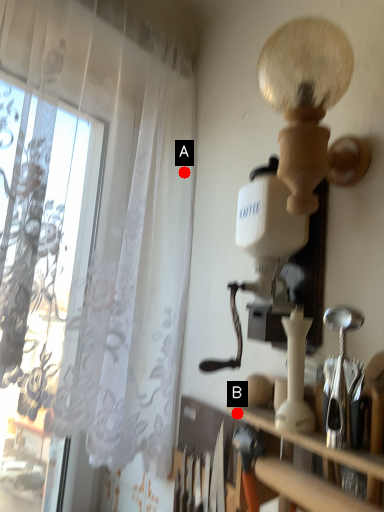
Question: Two points are circled on the image, labeled by A and B beside each circle. Which point appears closest to the camera in this image?

Choices:
 (A) A is closer
 (B) B is closer

Answer: (B)